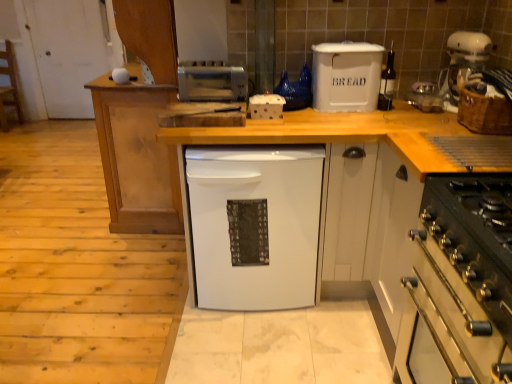
You are a GUI agent. You are given a task and a screenshot of the screen. Output one action in this format:
    pyautogui.click(x=<x>, y=<y>)
    Task: Click on the vacant area that is in front of clear plastic container at upper right, the 4th appliance viewed from the left
    
    Given the screenshot: What is the action you would take?
    pyautogui.click(x=425, y=118)